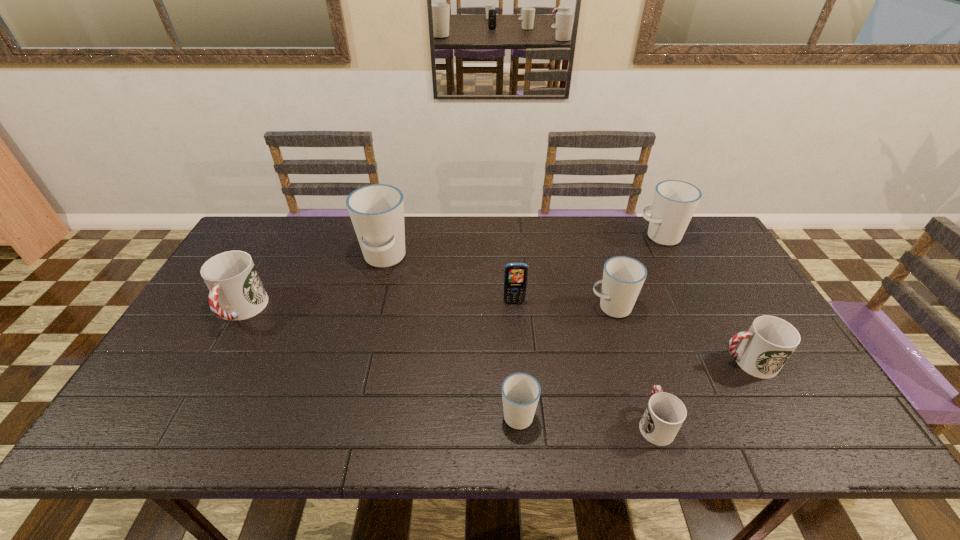
I want to click on free location that satisfies the following two spatial constraints: 1. with a handle on the side of the second tallest cup; 2. on the handle side of the sixth farthest object, so click(723, 362).

I want to click on free spot that satisfies the following two spatial constraints: 1. with a handle on the side of the seventh shortest object; 2. with a handle on the side of the seventh object from right to left, so click(x=671, y=259).

Locate an element on the screen. The width and height of the screenshot is (960, 540). free space that satisfies the following two spatial constraints: 1. on the handle side of the second farthest red cup; 2. with a handle on the side of the leftmost white cup is located at coordinates (690, 259).

What are the coordinates of `vacant space that satisfies the following two spatial constraints: 1. on the handle side of the second smallest red cup; 2. with a handle on the side of the tallest object` in the screenshot? It's located at (690, 259).

The width and height of the screenshot is (960, 540). I want to click on vacant space that satisfies the following two spatial constraints: 1. with a handle on the side of the seventh shortest object; 2. on the handle side of the third nearest cup, so click(x=723, y=362).

This screenshot has width=960, height=540. I want to click on vacant position in the image that satisfies the following two spatial constraints: 1. with a handle on the side of the biggest white cup; 2. on the handle side of the rightmost red cup, so 358,362.